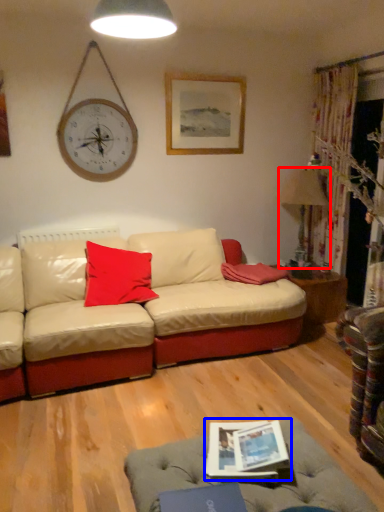
Question: Which object appears closest to the camera in this image, lamp (highlighted by a red box) or magazine (highlighted by a blue box)?

Choices:
 (A) lamp
 (B) magazine

Answer: (B)